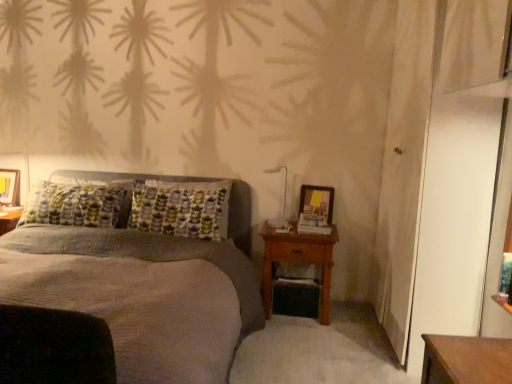
Question: Does white glossy bedside lamp at upper right have a lesser height compared to matte wooden picture frame at left, which ranks as the 2th picture frame in front-to-back order?

Choices:
 (A) no
 (B) yes

Answer: (A)

Question: Can you confirm if white glossy bedside lamp at upper right is smaller than matte wooden picture frame at left, placed as the 2th picture frame when sorted from right to left?

Choices:
 (A) no
 (B) yes

Answer: (A)

Question: Does white glossy bedside lamp at upper right appear on the right side of matte wooden picture frame at left, acting as the first picture frame starting from the back?

Choices:
 (A) no
 (B) yes

Answer: (B)

Question: From a real-world perspective, is white glossy bedside lamp at upper right located beneath matte wooden picture frame at left, placed as the 2th picture frame when sorted from right to left?

Choices:
 (A) yes
 (B) no

Answer: (B)

Question: Considering the relative sizes of white glossy bedside lamp at upper right and matte wooden picture frame at left, acting as the first picture frame starting from the back, in the image provided, is white glossy bedside lamp at upper right thinner than matte wooden picture frame at left, acting as the first picture frame starting from the back,?

Choices:
 (A) yes
 (B) no

Answer: (B)

Question: In the image, is white glossy bedside lamp at upper right on the left side or the right side of wooden nightstand at right?

Choices:
 (A) right
 (B) left

Answer: (B)

Question: From a real-world perspective, relative to wooden nightstand at right, is white glossy bedside lamp at upper right vertically above or below?

Choices:
 (A) below
 (B) above

Answer: (B)

Question: Is point (271, 223) positioned closer to the camera than point (325, 281)?

Choices:
 (A) farther
 (B) closer

Answer: (A)

Question: From the image's perspective, is white glossy bedside lamp at upper right located above or below wooden nightstand at right?

Choices:
 (A) above
 (B) below

Answer: (A)

Question: Which is correct: matte wooden picture frame at left, placed as the 2th picture frame when sorted from right to left, is inside wooden nightstand at right, or outside of it?

Choices:
 (A) outside
 (B) inside

Answer: (A)

Question: Based on their sizes in the image, would you say matte wooden picture frame at left, marked as the first picture frame in a left-to-right arrangement, is bigger or smaller than wooden nightstand at right?

Choices:
 (A) small
 (B) big

Answer: (A)

Question: From the image's perspective, is matte wooden picture frame at left, placed as the 2th picture frame when sorted from right to left, above or below wooden nightstand at right?

Choices:
 (A) above
 (B) below

Answer: (A)

Question: Relative to wooden nightstand at right, is matte wooden picture frame at left, which ranks as the 2th picture frame in front-to-back order, in front or behind?

Choices:
 (A) front
 (B) behind

Answer: (B)

Question: Is wooden nightstand at right to the left or to the right of textured gray bed at center in the image?

Choices:
 (A) right
 (B) left

Answer: (A)

Question: Considering the positions of wooden nightstand at right and textured gray bed at center in the image, is wooden nightstand at right wider or thinner than textured gray bed at center?

Choices:
 (A) thin
 (B) wide

Answer: (A)